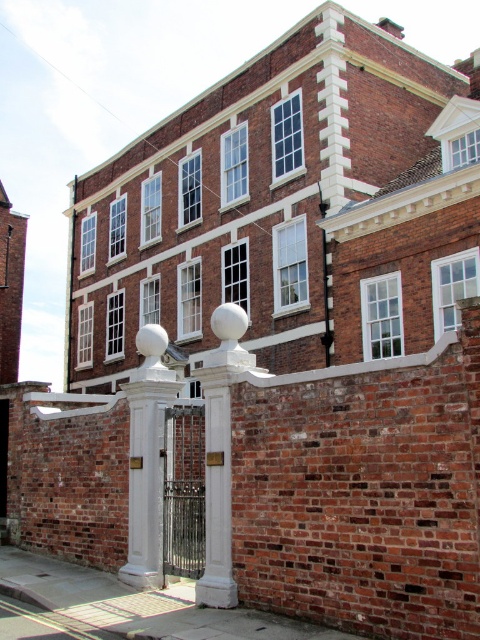
Which is above, white polished stone pillar at center or white glossy pillar at center?

white glossy pillar at center is above.

Is white polished stone pillar at center further to camera compared to white glossy pillar at center?

Yes.

What are the coordinates of `white polished stone pillar at center` in the screenshot? It's located at (146, 458).

The image size is (480, 640). In order to click on white polished stone pillar at center in this screenshot , I will do coord(146,458).